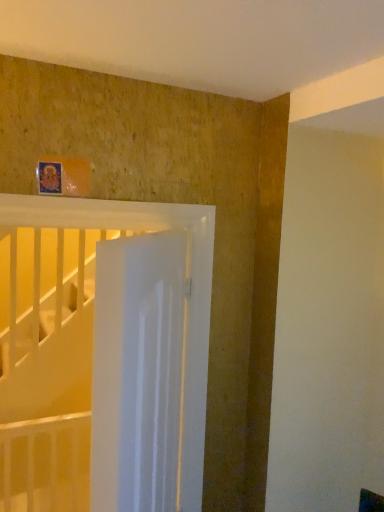
Question: From a real-world perspective, is white glossy door at center above or below white glossy bed at upper center?

Choices:
 (A) below
 (B) above

Answer: (A)

Question: Based on their sizes in the image, would you say white glossy door at center is bigger or smaller than white glossy bed at upper center?

Choices:
 (A) small
 (B) big

Answer: (B)

Question: In terms of width, does white glossy door at center look wider or thinner when compared to white glossy bed at upper center?

Choices:
 (A) thin
 (B) wide

Answer: (B)

Question: Considering the positions of point (180, 226) and point (99, 358), is point (180, 226) closer or farther from the camera than point (99, 358)?

Choices:
 (A) farther
 (B) closer

Answer: (A)

Question: Is white glossy bed at upper center in front of or behind white glossy door at center in the image?

Choices:
 (A) front
 (B) behind

Answer: (B)

Question: Choose the correct answer: Is white glossy bed at upper center inside white glossy door at center or outside it?

Choices:
 (A) outside
 (B) inside

Answer: (A)

Question: Is white glossy bed at upper center wider or thinner than white glossy door at center?

Choices:
 (A) wide
 (B) thin

Answer: (B)